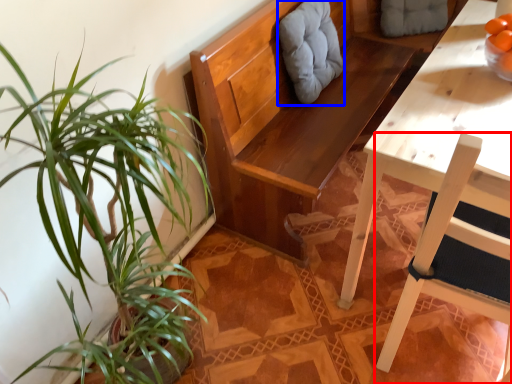
Question: Which of the following is the closest to the observer, chair (highlighted by a red box) or swivel chair (highlighted by a blue box)?

Choices:
 (A) chair
 (B) swivel chair

Answer: (A)